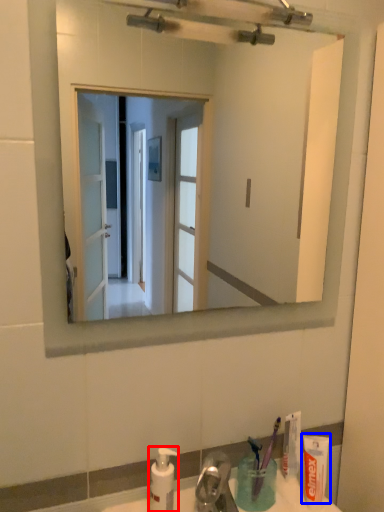
Question: Which object appears closest to the camera in this image, soap dispenser (highlighted by a red box) or toothpaste (highlighted by a blue box)?

Choices:
 (A) soap dispenser
 (B) toothpaste

Answer: (A)